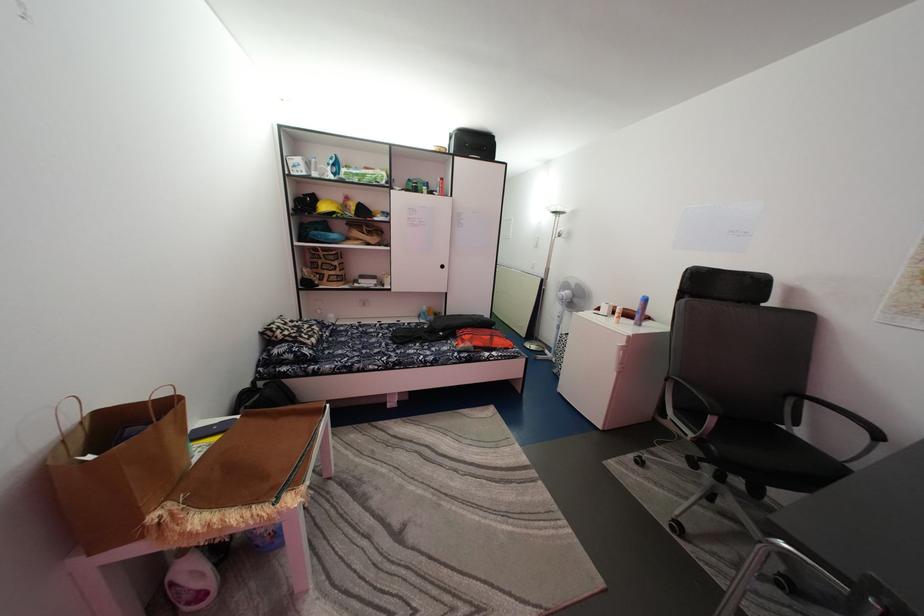
Find where to lift the black backpack. Please return your answer as a coordinate pair (x, y).

(263, 397)